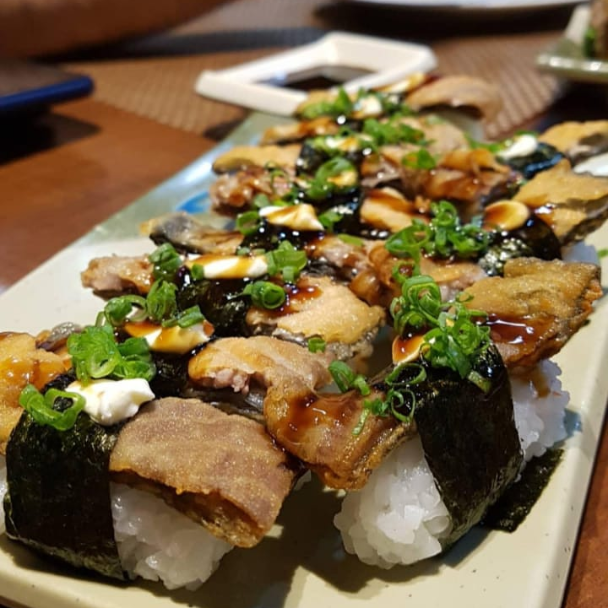
The height and width of the screenshot is (608, 608). I want to click on tables, so click(590, 557), click(92, 140).